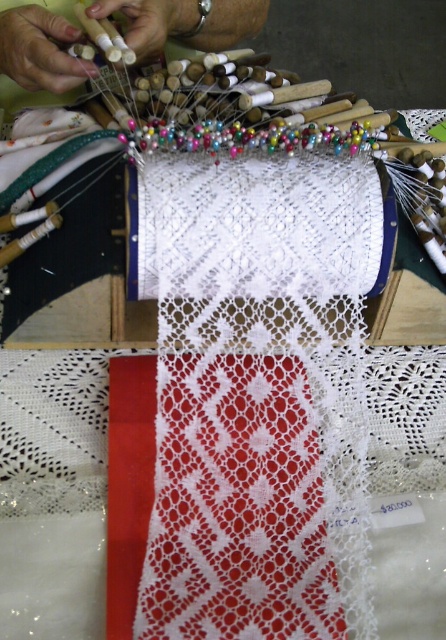
In the scene shown: Does matte white hand at upper left appear over white matte wooden sticks at upper center?

Answer: No.

Locate an element on the screen. matte white hand at upper left is located at coordinates (41, 51).